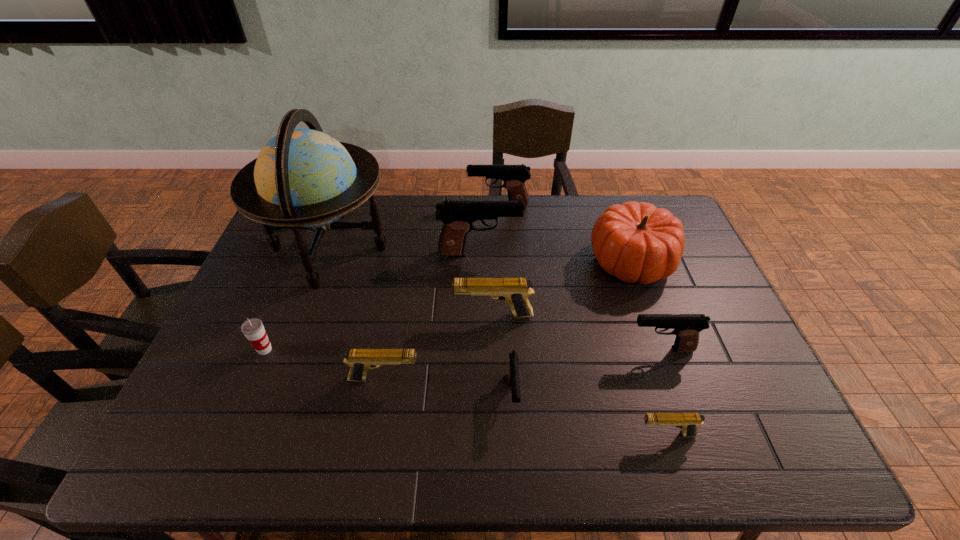
Find the location of a particular element. free region located 0.270m at the barrel of the rightmost tan pistol is located at coordinates (519, 434).

This screenshot has width=960, height=540. In order to click on vacant space situated at the barrel of the rightmost tan pistol in this screenshot , I will do `click(493, 434)`.

You are a GUI agent. You are given a task and a screenshot of the screen. Output one action in this format:
    pyautogui.click(x=<x>, y=<y>)
    Task: Click on the vacant region located 0.080m at the barrel of the rightmost tan pistol
    
    Given the screenshot: What is the action you would take?
    coord(602,434)

Where is `globe that is at the far edge`? The height and width of the screenshot is (540, 960). globe that is at the far edge is located at coordinates (303, 178).

You are a GUI agent. You are given a task and a screenshot of the screen. Output one action in this format:
    pyautogui.click(x=<x>, y=<y>)
    Task: Click on the pumpkin present at the far edge
    
    Given the screenshot: What is the action you would take?
    pyautogui.click(x=636, y=242)

This screenshot has width=960, height=540. In order to click on pistol that is at the far edge in this screenshot , I will do `click(514, 176)`.

The height and width of the screenshot is (540, 960). Identify the location of object that is at the near edge. (688, 422).

In order to click on globe located at the left edge in this screenshot , I will do `click(303, 178)`.

Find the location of `cup that is at the left edge`. cup that is at the left edge is located at coordinates (253, 329).

You are a GUI agent. You are given a task and a screenshot of the screen. Output one action in this format:
    pyautogui.click(x=<x>, y=<y>)
    Task: Click on the pumpkin positioned at the right edge
    
    Given the screenshot: What is the action you would take?
    pyautogui.click(x=636, y=242)